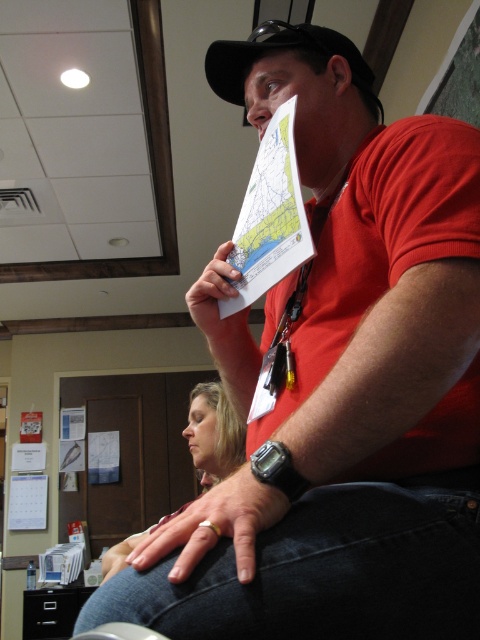
Based on the photo, between silver metallic watch at lower center and blonde hair at lower left, which one is positioned lower?

blonde hair at lower left

Locate an element on the screen. The width and height of the screenshot is (480, 640). silver metallic watch at lower center is located at coordinates (216, 525).

Does silver metallic watch at lower center come in front of white paper at center?

Yes, it is in front of white paper at center.

Is silver metallic watch at lower center thinner than white paper at center?

In fact, silver metallic watch at lower center might be wider than white paper at center.

Which is behind, point (248, 544) or point (222, 372)?

The point (222, 372) is more distant.

The height and width of the screenshot is (640, 480). Find the location of `silver metallic watch at lower center`. silver metallic watch at lower center is located at coordinates (216, 525).

Is point (211, 541) positioned before point (303, 40)?

Yes, point (211, 541) is closer to viewer.

Is point (256, 518) positioned in front of point (344, 42)?

Yes, it is.

Locate an element on the screen. This screenshot has height=640, width=480. silver metallic watch at lower center is located at coordinates (216, 525).